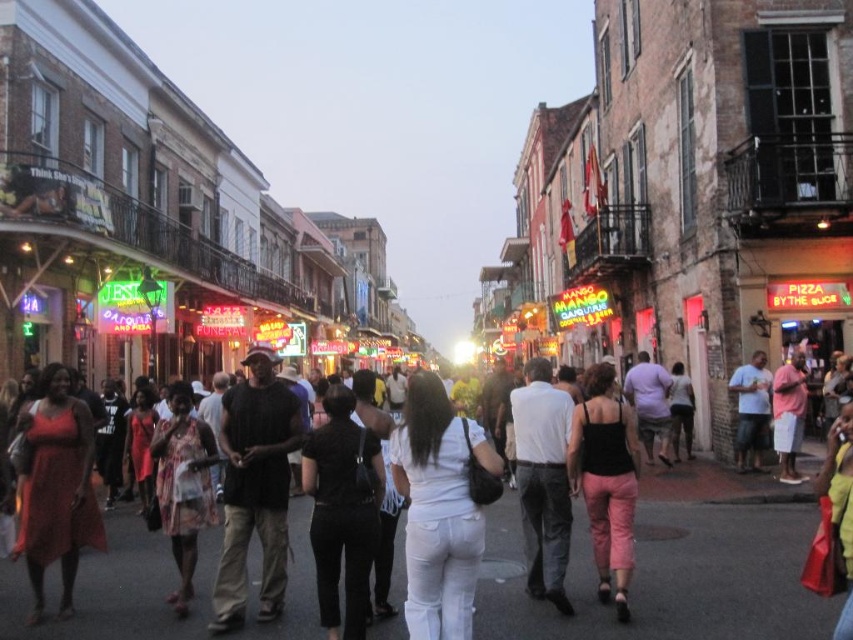
You are standing on the street and want to walk to the point labeled point (x=55, y=488). There is an obstacle at point (x=579, y=416). Will you encounter the obstacle before reaching your destination?

Point (x=55, y=488) is in front of point (x=579, y=416), so you will reach the destination before encountering the obstacle.